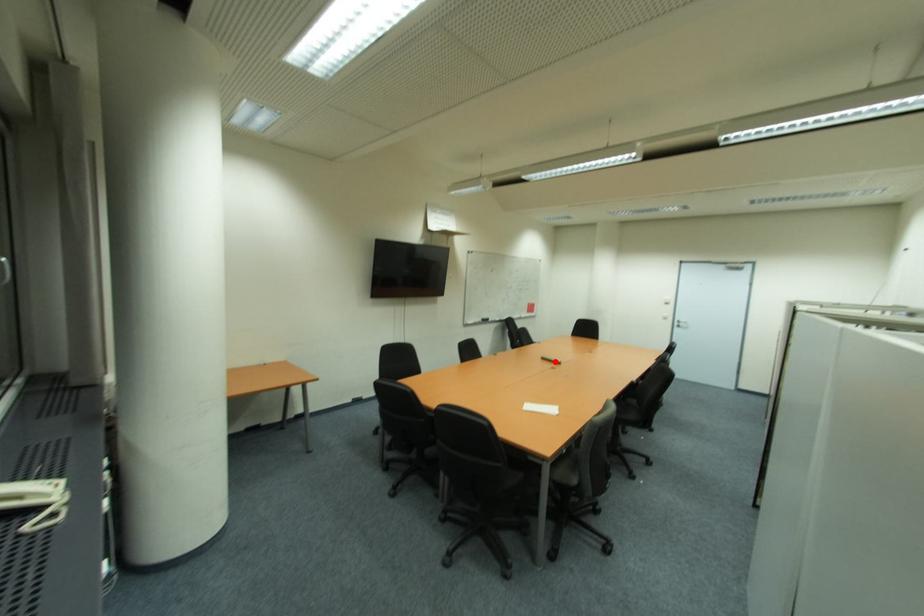
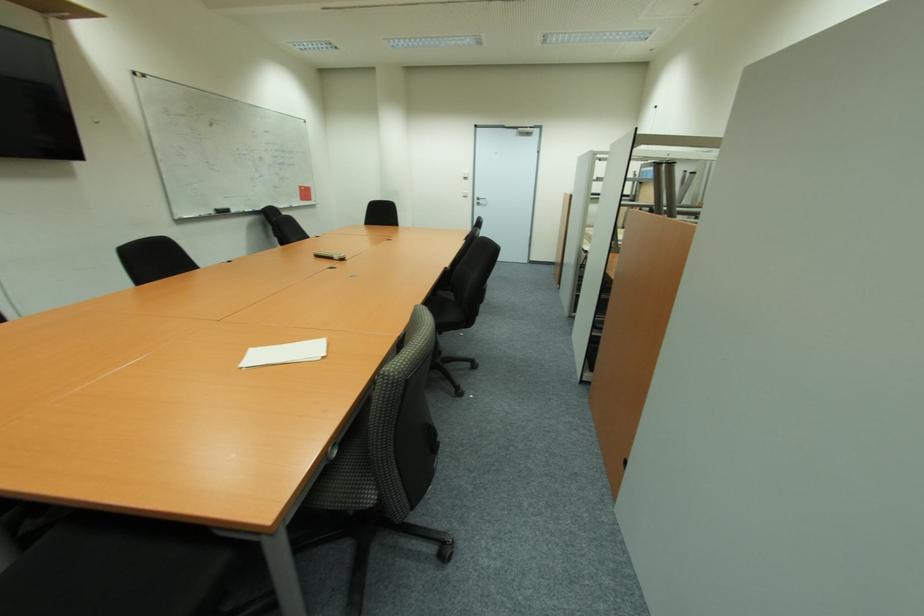
The point at the highlighted location is marked in the first image. Where is the corresponding point in the second image?

(334, 259)